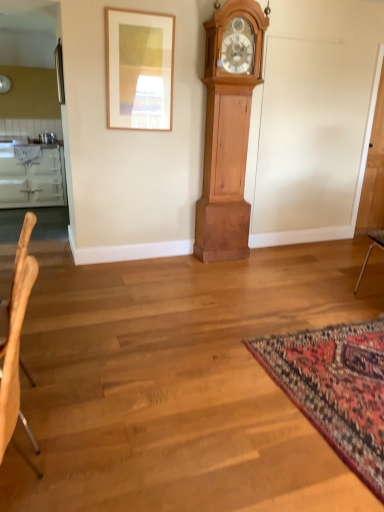
Question: Is wooden picture frame at upper center positioned in front of light brown wood chair at left?

Choices:
 (A) no
 (B) yes

Answer: (A)

Question: Does wooden picture frame at upper center touch light brown wood chair at left?

Choices:
 (A) yes
 (B) no

Answer: (B)

Question: Is wooden picture frame at upper center bigger than light brown wood chair at left?

Choices:
 (A) no
 (B) yes

Answer: (A)

Question: Would you say wooden picture frame at upper center is outside light brown wood chair at left?

Choices:
 (A) yes
 (B) no

Answer: (A)

Question: From a real-world perspective, is wooden picture frame at upper center located higher than light brown wood chair at left?

Choices:
 (A) no
 (B) yes

Answer: (B)

Question: Would you say carpet with intricate patterns at lower right is inside or outside light brown wood chair at left?

Choices:
 (A) outside
 (B) inside

Answer: (A)

Question: In terms of width, does carpet with intricate patterns at lower right look wider or thinner when compared to light brown wood chair at left?

Choices:
 (A) wide
 (B) thin

Answer: (A)

Question: Would you say carpet with intricate patterns at lower right is to the left or to the right of light brown wood chair at left in the picture?

Choices:
 (A) left
 (B) right

Answer: (B)

Question: In the image, is carpet with intricate patterns at lower right positioned in front of or behind light brown wood chair at left?

Choices:
 (A) behind
 (B) front

Answer: (A)

Question: In terms of height, does light brown wood grandfather clock at center look taller or shorter compared to white glossy cabinetry at left?

Choices:
 (A) tall
 (B) short

Answer: (A)

Question: From the image's perspective, is light brown wood grandfather clock at center above or below white glossy cabinetry at left?

Choices:
 (A) above
 (B) below

Answer: (B)

Question: Considering their positions, is light brown wood grandfather clock at center located in front of or behind white glossy cabinetry at left?

Choices:
 (A) behind
 (B) front

Answer: (B)

Question: Is light brown wood grandfather clock at center wider or thinner than white glossy cabinetry at left?

Choices:
 (A) thin
 (B) wide

Answer: (A)

Question: Is carpet with intricate patterns at lower right wider or thinner than wooden picture frame at upper center?

Choices:
 (A) wide
 (B) thin

Answer: (A)

Question: Would you say carpet with intricate patterns at lower right is inside or outside wooden picture frame at upper center?

Choices:
 (A) inside
 (B) outside

Answer: (B)